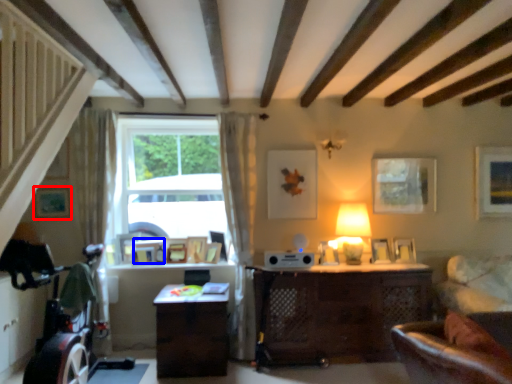
Question: Which object appears closest to the camera in this image, picture frame (highlighted by a red box) or picture frame (highlighted by a blue box)?

Choices:
 (A) picture frame
 (B) picture frame

Answer: (A)